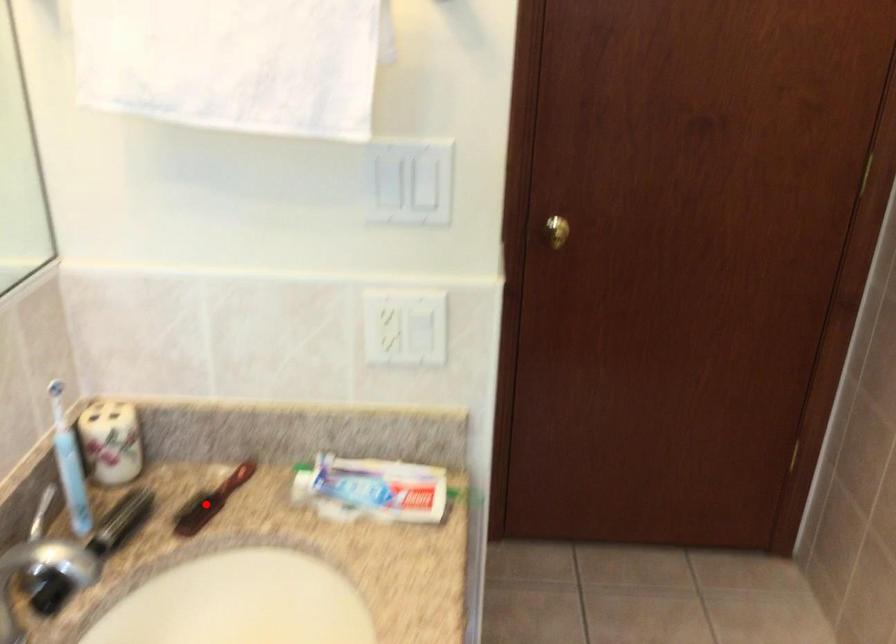
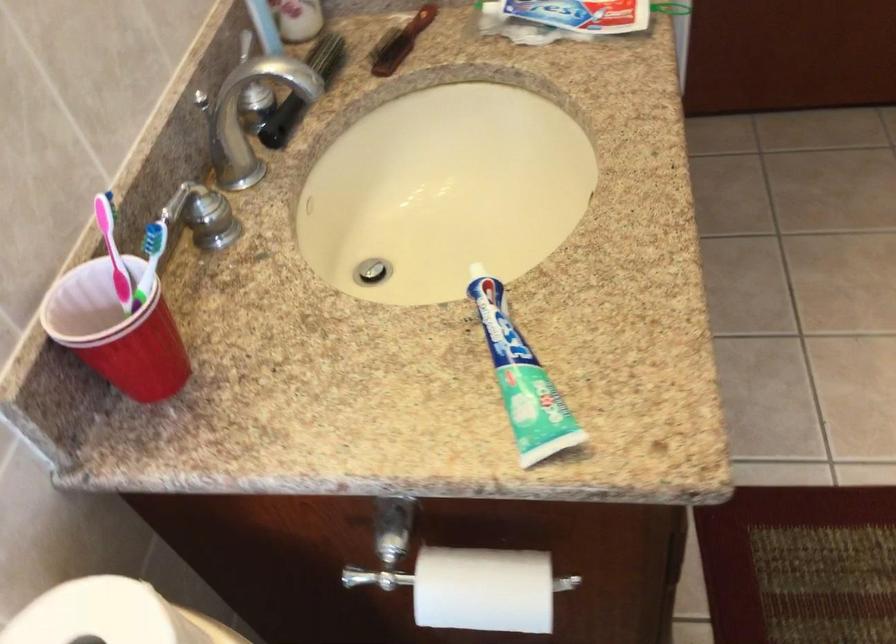
Find the pixel in the second image that matches the highlighted location in the first image.

(400, 42)